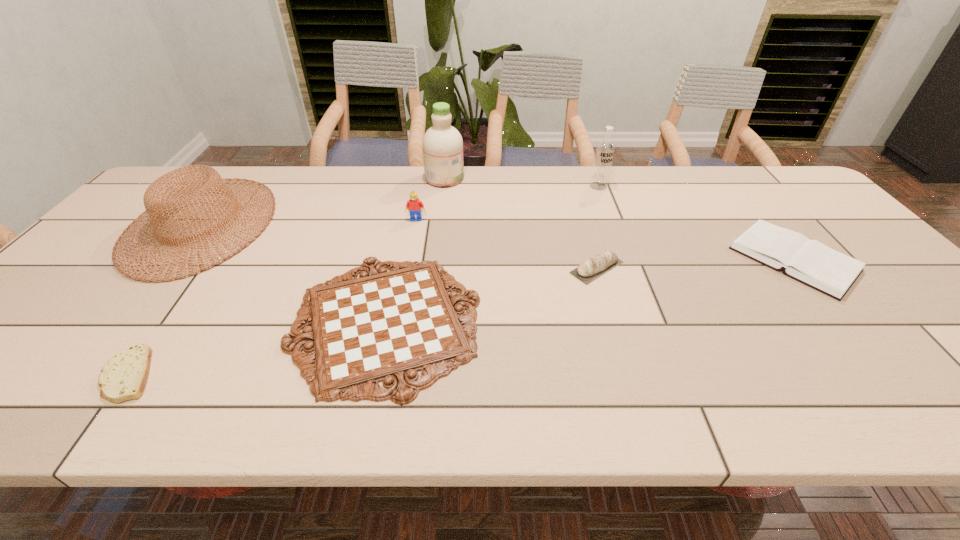
The image size is (960, 540). Find the location of `vodka at the far edge`. vodka at the far edge is located at coordinates (604, 153).

You are a GUI agent. You are given a task and a screenshot of the screen. Output one action in this format:
    pyautogui.click(x=<x>, y=<y>)
    Task: Click on the sunhat located in the far edge section of the desktop
    The height and width of the screenshot is (540, 960).
    Given the screenshot: What is the action you would take?
    pyautogui.click(x=169, y=201)

This screenshot has width=960, height=540. Identify the location of chessboard located at the near edge. (384, 326).

This screenshot has height=540, width=960. Find the location of `pita bread located at the near edge`. pita bread located at the near edge is located at coordinates (124, 376).

Where is `object that is positioned at the left edge`? The image size is (960, 540). object that is positioned at the left edge is located at coordinates (169, 201).

This screenshot has height=540, width=960. Identify the location of object positioned at the right edge. (810, 262).

The image size is (960, 540). I want to click on object positioned at the far left corner, so [169, 201].

In the image, there is a desktop. Identify the location of free space at the far edge. This screenshot has width=960, height=540. (646, 174).

Where is `free space at the near edge of the desktop`? free space at the near edge of the desktop is located at coordinates (842, 407).

In the image, there is a desktop. Where is `vacant space at the left edge`? vacant space at the left edge is located at coordinates (102, 302).